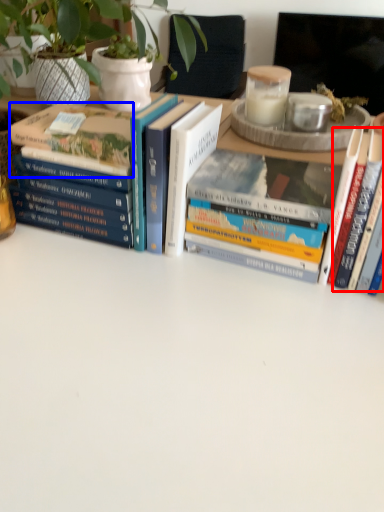
Question: Among these objects, which one is farthest to the camera, book (highlighted by a red box) or book (highlighted by a blue box)?

Choices:
 (A) book
 (B) book

Answer: (B)